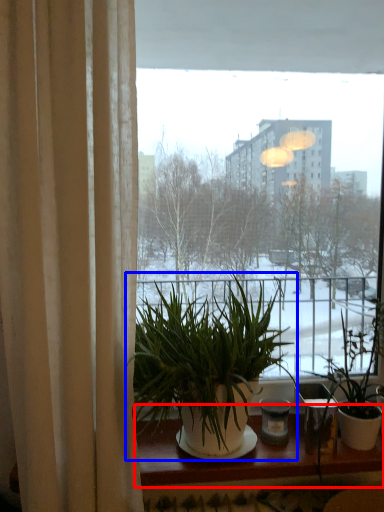
Question: Which of the following is the farthest to the observer, window sill (highlighted by a red box) or houseplant (highlighted by a blue box)?

Choices:
 (A) window sill
 (B) houseplant

Answer: (A)